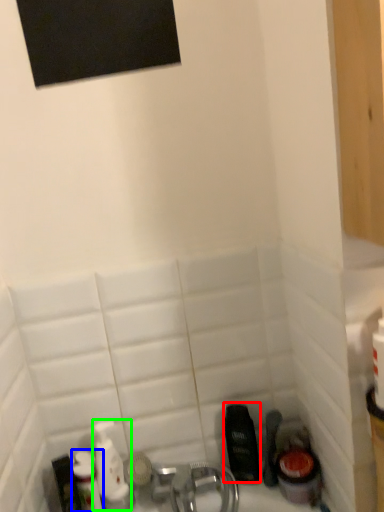
Question: Which object is the farthest from mouthwash (highlighted by a red box)? Choose among these: toiletry (highlighted by a blue box) or mouthwash (highlighted by a green box).

Choices:
 (A) toiletry
 (B) mouthwash

Answer: (A)